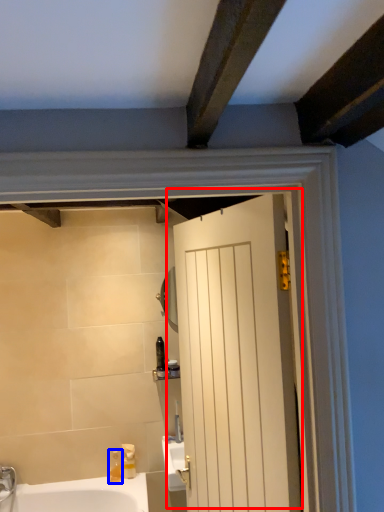
Question: Among these objects, which one is nearest to the camera, door (highlighted by a red box) or soap dispenser (highlighted by a blue box)?

Choices:
 (A) door
 (B) soap dispenser

Answer: (A)